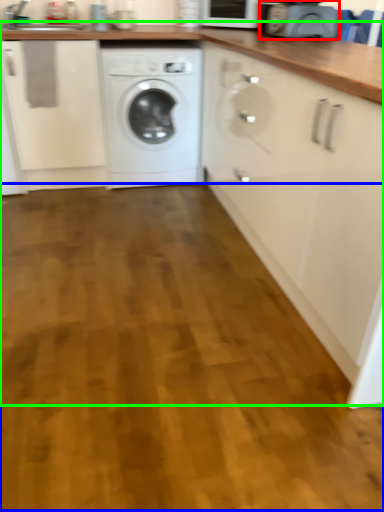
Question: Which object is the farthest from appliance (highlighted by a red box)? Choose among these: plain (highlighted by a blue box) or counter (highlighted by a green box).

Choices:
 (A) plain
 (B) counter

Answer: (A)